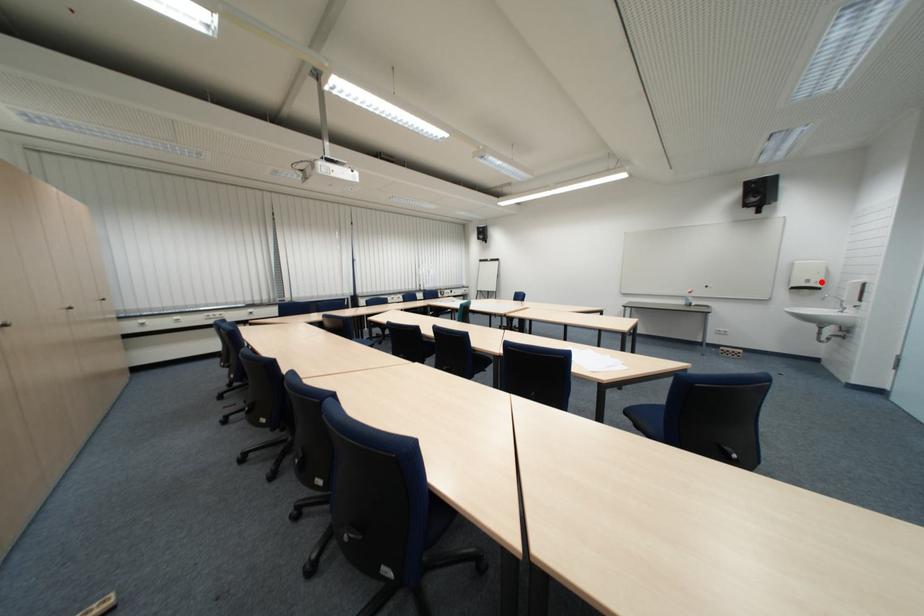
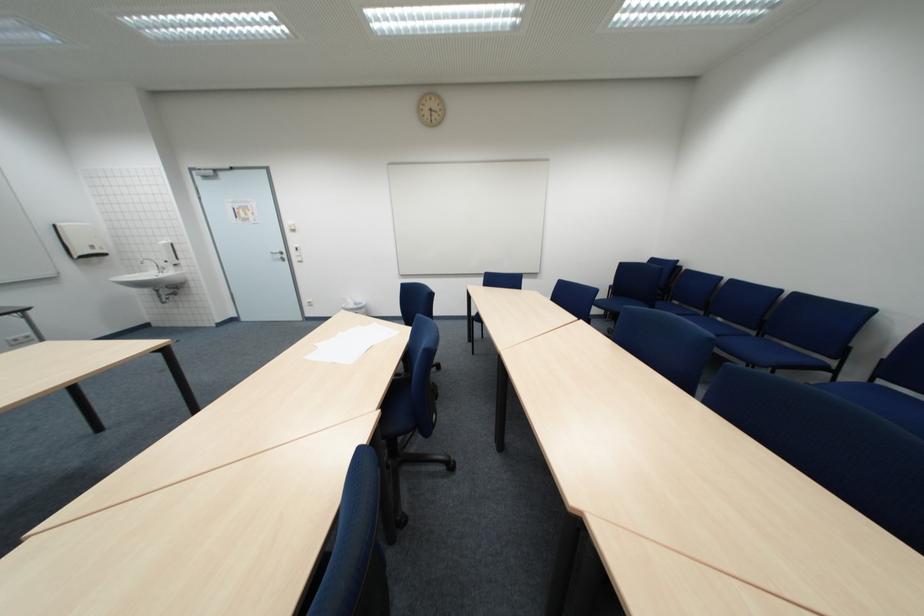
Question: A red point is marked in image1. In image2, is the corresponding 3D point closer to the camera or farther? Reply with the corresponding letter.

Choices:
 (A) The corresponding 3D point is closer.
 (B) The corresponding 3D point is farther.

Answer: (A)